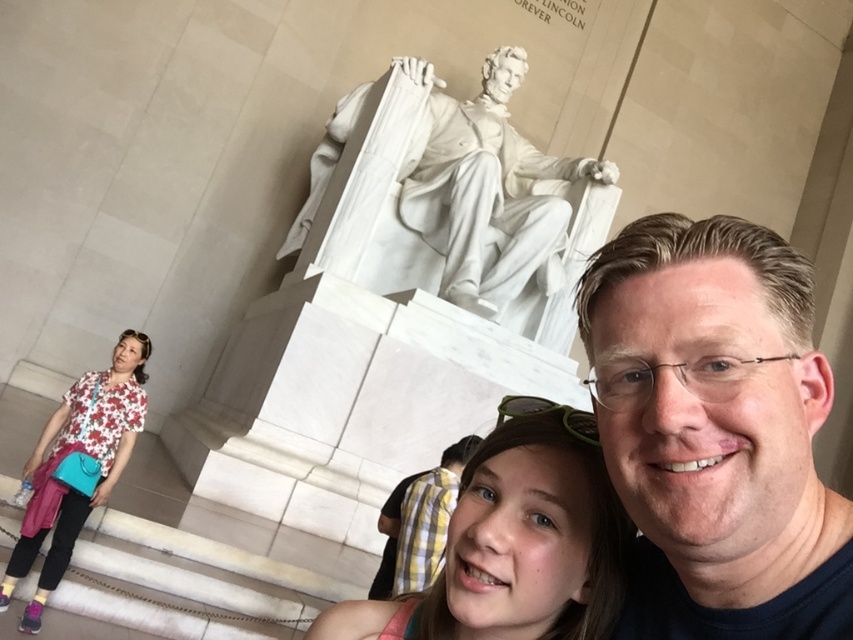
Does floral fabric shirt at lower center have a smaller size compared to floral fabric blouse at lower left?

Yes, floral fabric shirt at lower center is smaller than floral fabric blouse at lower left.

Where is `floral fabric shirt at lower center`? floral fabric shirt at lower center is located at coordinates (514, 548).

What are the coordinates of `floral fabric shirt at lower center` in the screenshot? It's located at (514, 548).

Is white marble statue at center below floral fabric shirt at lower center?

Actually, white marble statue at center is above floral fabric shirt at lower center.

Between point (480, 314) and point (567, 467), which one is positioned behind?

The point (480, 314) is behind.

Identify the location of white marble statue at center. Image resolution: width=853 pixels, height=640 pixels. [498, 200].

Based on the photo, is the position of matte white statue at center less distant than that of floral fabric blouse at lower left?

Yes, matte white statue at center is in front of floral fabric blouse at lower left.

Is matte white statue at center to the right of floral fabric blouse at lower left from the viewer's perspective?

Yes, matte white statue at center is to the right of floral fabric blouse at lower left.

Identify the location of matte white statue at center. (717, 432).